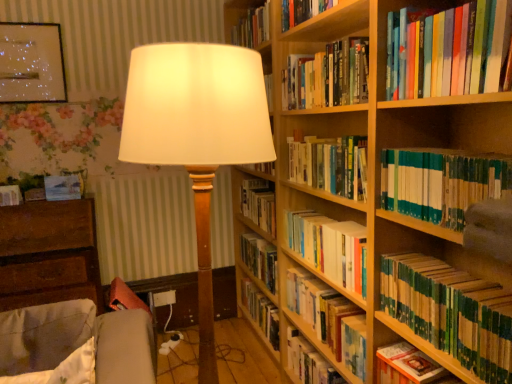
Identify the location of hardcover book at left, marked as the second paperback book in a right-to-left arrangement. The width and height of the screenshot is (512, 384). (10, 195).

What do you see at coordinates (328, 317) in the screenshot? The width and height of the screenshot is (512, 384). I see `hardcover book at center, positioned as the 3th book in bottom-to-top order` at bounding box center [328, 317].

Find the location of a particular element. matte blue painting at left, the second paperback book viewed from the left is located at coordinates (63, 187).

Locate an element on the screen. This screenshot has width=512, height=384. hardcover books at center, positioned as the second book in top-to-bottom order is located at coordinates (330, 164).

This screenshot has height=384, width=512. Identify the location of teal hardcover books at right, placed as the third book when sorted from top to bottom. (441, 183).

The height and width of the screenshot is (384, 512). I want to click on hardcover book at left, marked as the second paperback book in a right-to-left arrangement, so click(x=10, y=195).

Measure the distance from hardcover book at upper right, the 1th book from the top, to matte blue painting at left, the second paperback book viewed from the left.

hardcover book at upper right, the 1th book from the top, is 6.28 feet away from matte blue painting at left, the second paperback book viewed from the left.

Is hardcover book at upper right, the 1th book from the top, bigger or smaller than matte blue painting at left, the second paperback book viewed from the left?

Considering their sizes, hardcover book at upper right, the 1th book from the top, takes up more space than matte blue painting at left, the second paperback book viewed from the left.

Is hardcover book at upper right, the 1th book from the top, beside matte blue painting at left, the 1th paperback book viewed from the right?

No, hardcover book at upper right, the 1th book from the top, is not with matte blue painting at left, the 1th paperback book viewed from the right.

From the picture: Which object is positioned more to the right, hardcover book at upper right, which is the 8th book from bottom to top, or matte blue painting at left, the second paperback book viewed from the left?

From the viewer's perspective, hardcover book at upper right, which is the 8th book from bottom to top, appears more on the right side.

From the image's perspective, is matte blue painting at left, the 1th paperback book viewed from the right, above or below hardcover books at center, the seventh book positioned from the bottom?

matte blue painting at left, the 1th paperback book viewed from the right, is situated lower than hardcover books at center, the seventh book positioned from the bottom, in the image.

Is matte blue painting at left, the second paperback book viewed from the left, behind hardcover books at center, the seventh book positioned from the bottom?

Yes, matte blue painting at left, the second paperback book viewed from the left, is further from the viewer.

Are matte blue painting at left, the 1th paperback book viewed from the right, and hardcover books at center, positioned as the second book in top-to-bottom order, located far from each other?

matte blue painting at left, the 1th paperback book viewed from the right, is positioned a significant distance from hardcover books at center, positioned as the second book in top-to-bottom order.

Looking at this image, which of these two, matte blue painting at left, the second paperback book viewed from the left, or hardcover books at center, positioned as the second book in top-to-bottom order, is bigger?

With larger size is hardcover books at center, positioned as the second book in top-to-bottom order.

Is hardcover book at upper right, the 1th book from the top, inside matte white lampshade at center?

No, hardcover book at upper right, the 1th book from the top, is located outside of matte white lampshade at center.

Considering the sizes of matte white lampshade at center and hardcover book at upper right, the 1th book from the top, in the image, is matte white lampshade at center wider or thinner than hardcover book at upper right, the 1th book from the top,?

matte white lampshade at center is wider than hardcover book at upper right, the 1th book from the top.

Does matte white lampshade at center turn towards hardcover book at upper right, the 1th book from the top?

No, matte white lampshade at center is not aimed at hardcover book at upper right, the 1th book from the top.

In terms of height, does matte white lampshade at center look taller or shorter compared to hardcover book at upper right, the 1th book from the top?

Considering their sizes, matte white lampshade at center has more height than hardcover book at upper right, the 1th book from the top.

This screenshot has height=384, width=512. Identify the location of bookcase on the right of the metallic silver frame at upper left. (376, 206).

From the image's perspective, between wooden bookcase at right and metallic silver frame at upper left, which one is located above?

From the image's view, metallic silver frame at upper left is above.

Is wooden bookcase at right next to metallic silver frame at upper left?

No, wooden bookcase at right is not making contact with metallic silver frame at upper left.

Is wooden bookcase at right oriented towards metallic silver frame at upper left?

Yes.

Does hardcover book at left, marked as the second paperback book in a right-to-left arrangement, have a lesser width compared to teal hardcover books at right, placed as the third book when sorted from top to bottom?

Yes.

Is hardcover book at left, arranged as the 1th paperback book when viewed from the left, closer to the viewer compared to teal hardcover books at right, placed as the third book when sorted from top to bottom?

No, hardcover book at left, arranged as the 1th paperback book when viewed from the left, is further to the viewer.

From a real-world perspective, is hardcover book at left, arranged as the 1th paperback book when viewed from the left, physically below teal hardcover books at right, positioned as the 6th book in bottom-to-top order?

Yes, from a real-world perspective, hardcover book at left, arranged as the 1th paperback book when viewed from the left, is under teal hardcover books at right, positioned as the 6th book in bottom-to-top order.

Is point (13, 191) closer or farther from the camera than point (446, 155)?

Point (13, 191) is positioned farther from the camera compared to point (446, 155).

Does point (240, 71) come behind point (26, 39)?

No, it is in front of (26, 39).

Consider the image. Are matte white lampshade at center and metallic silver frame at upper left far apart?

matte white lampshade at center is positioned a significant distance from metallic silver frame at upper left.

Where is `picture frame behind the matte white lampshade at center`? This screenshot has height=384, width=512. picture frame behind the matte white lampshade at center is located at coordinates (31, 63).

Does matte white lampshade at center have a greater width compared to metallic silver frame at upper left?

Yes.

Does metallic silver frame at upper left contain hardcover book at left, arranged as the 1th paperback book when viewed from the left?

Actually, hardcover book at left, arranged as the 1th paperback book when viewed from the left, is outside metallic silver frame at upper left.

The image size is (512, 384). I want to click on picture frame above the hardcover book at left, marked as the second paperback book in a right-to-left arrangement (from the image's perspective), so click(x=31, y=63).

Which object is positioned more to the right, metallic silver frame at upper left or hardcover book at left, marked as the second paperback book in a right-to-left arrangement?

metallic silver frame at upper left.

Is metallic silver frame at upper left far from hardcover book at left, arranged as the 1th paperback book when viewed from the left?

metallic silver frame at upper left is near hardcover book at left, arranged as the 1th paperback book when viewed from the left, not far away.

Which book is the 8th one when counting from the front of the matte blue painting at left, the 1th paperback book viewed from the right? Please provide its 2D coordinates.

[(448, 50)]

The image size is (512, 384). In order to click on the 1st book above the matte blue painting at left, the 1th paperback book viewed from the right (from the image's perspective) in this screenshot , I will do `click(330, 164)`.

Looking at the image, which one is located further to green matte book at lower right, which appears as the 5th book when viewed from the top, hardcover book at center, placed as the sixth book when sorted from top to bottom, or brown wooden chest of drawers at lower left?

brown wooden chest of drawers at lower left.

Considering their positions, is hardcover book at center, the 8th book viewed from the top, positioned closer to hardcover book at upper right, which is the 8th book from bottom to top, than green matte book at lower right, the fourth book from the bottom?

green matte book at lower right, the fourth book from the bottom, lies closer to hardcover book at upper right, which is the 8th book from bottom to top, than the other object.

Consider the image. From the image, which object appears to be nearer to matte blue painting at left, the 1th paperback book viewed from the right, hardcover book at left, marked as the second paperback book in a right-to-left arrangement, or teal hardcover books at right, placed as the third book when sorted from top to bottom?

hardcover book at left, marked as the second paperback book in a right-to-left arrangement.

From the image, which object appears to be nearer to metallic silver frame at upper left, brown wooden chest of drawers at lower left or hardcover book at center, the 8th book viewed from the top?

The object closer to metallic silver frame at upper left is brown wooden chest of drawers at lower left.

Which object lies nearer to the anchor point hardcover book at center, positioned as the 3th book in bottom-to-top order, matte white lampshade at center or green matte book at lower right, which appears as the 5th book when viewed from the top?

green matte book at lower right, which appears as the 5th book when viewed from the top, is positioned closer to the anchor hardcover book at center, positioned as the 3th book in bottom-to-top order.

Looking at the image, which one is located further to hardcover book at center, the 8th book viewed from the top, brown wooden chest of drawers at lower left or hardcover book at upper right, which is the 8th book from bottom to top?

hardcover book at upper right, which is the 8th book from bottom to top.

When comparing their distances from hardcover books at center, which is the fourth book in top-to-bottom order, does hardcover book at left, arranged as the 1th paperback book when viewed from the left, or hardcover book at center, placed as the sixth book when sorted from top to bottom, seem closer?

Among the two, hardcover book at center, placed as the sixth book when sorted from top to bottom, is located nearer to hardcover books at center, which is the fourth book in top-to-bottom order.

From the image, which object appears to be nearer to matte white lampshade at center, matte blue painting at left, the second paperback book viewed from the left, or brown wooden chest of drawers at lower left?

brown wooden chest of drawers at lower left lies closer to matte white lampshade at center than the other object.

At what (x,y) coordinates should I click in order to perform the action: click on bookcase situated between brown wooden chest of drawers at lower left and hardcover books at center, the seventh book positioned from the bottom, from left to right. Please return your answer as a coordinate pair (x, y). Looking at the image, I should click on (376, 206).

Image resolution: width=512 pixels, height=384 pixels. Identify the location of lamp located between metallic silver frame at upper left and hardcover books at center, which appears as the fifth book when ordered from the bottom, in the left-right direction. (197, 135).

You are a GUI agent. You are given a task and a screenshot of the screen. Output one action in this format:
    pyautogui.click(x=<x>, y=<y>)
    Task: Click on the bookcase between metallic silver frame at upper left and hardcover book at lower right, the seventh book in the top-to-bottom sequence
    The width and height of the screenshot is (512, 384).
    Given the screenshot: What is the action you would take?
    pyautogui.click(x=376, y=206)

This screenshot has height=384, width=512. What are the coordinates of `picture frame between hardcover book at left, marked as the second paperback book in a right-to-left arrangement, and hardcover books at center, which appears as the fifth book when ordered from the bottom` in the screenshot? It's located at (31, 63).